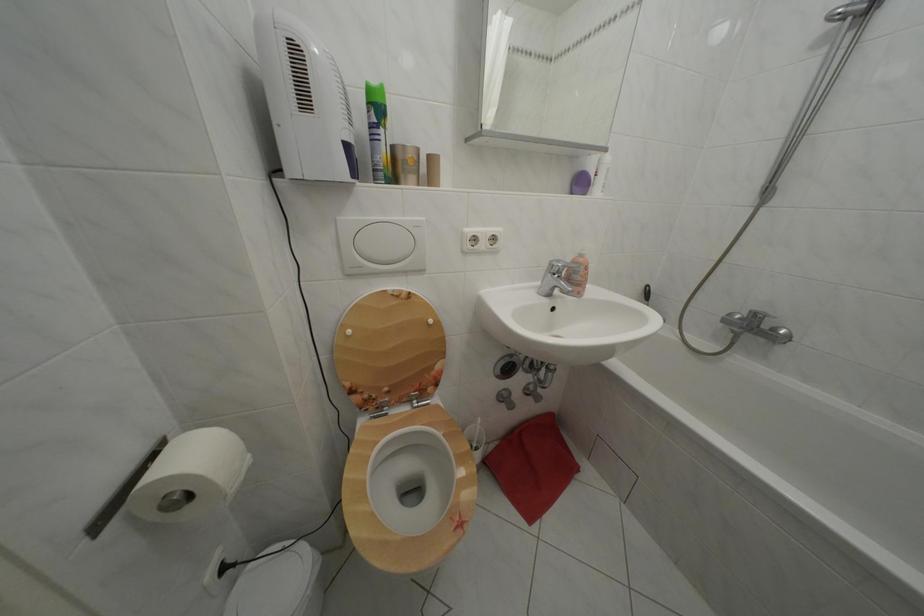
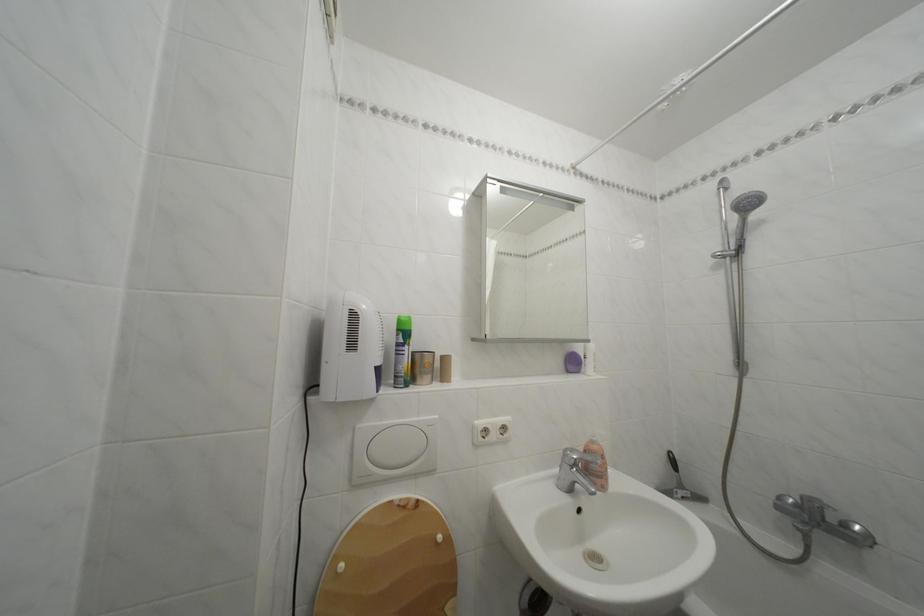
In the second image, find the point that corresponds to (x=749, y=325) in the first image.

(806, 512)